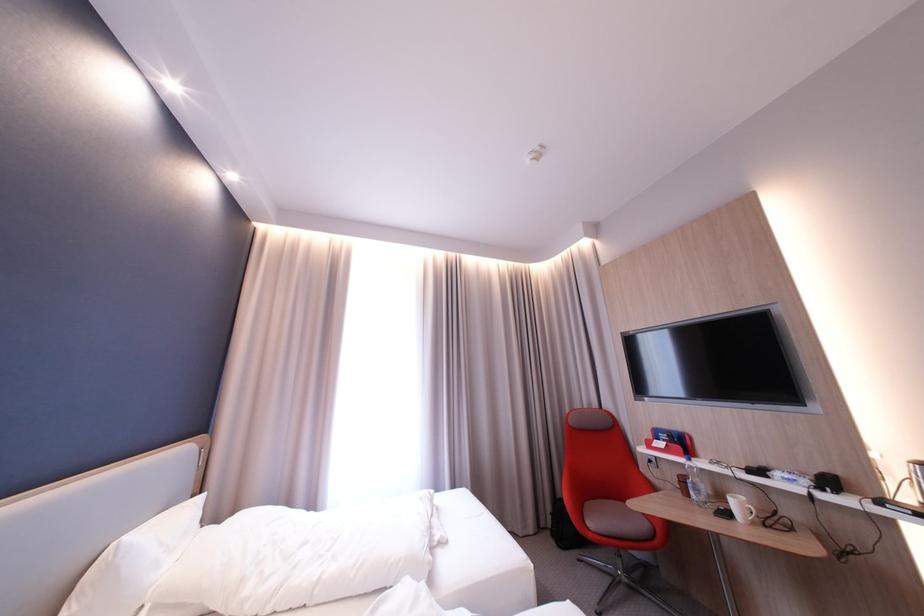
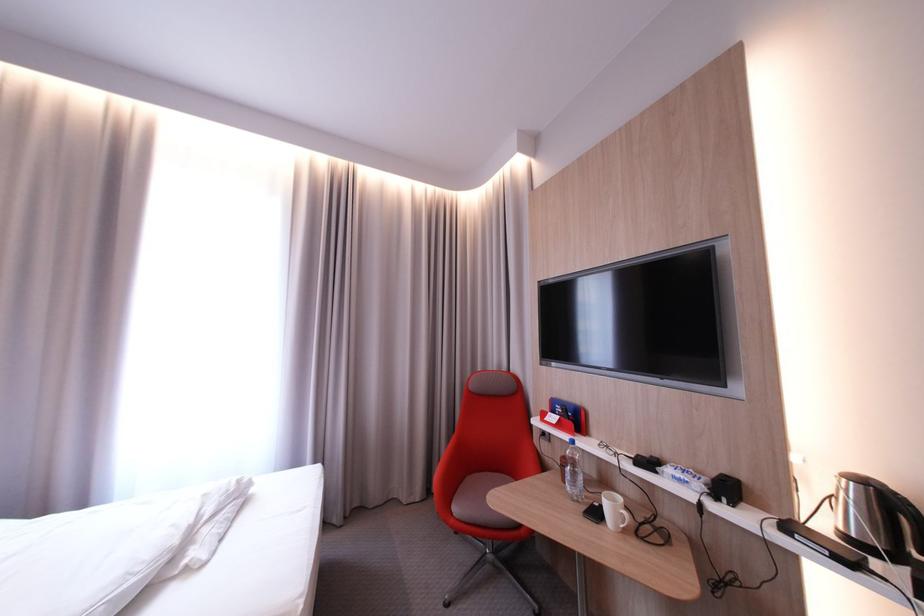
Where in the second image is the point corresponding to the point at 807,480 from the first image?

(699, 483)